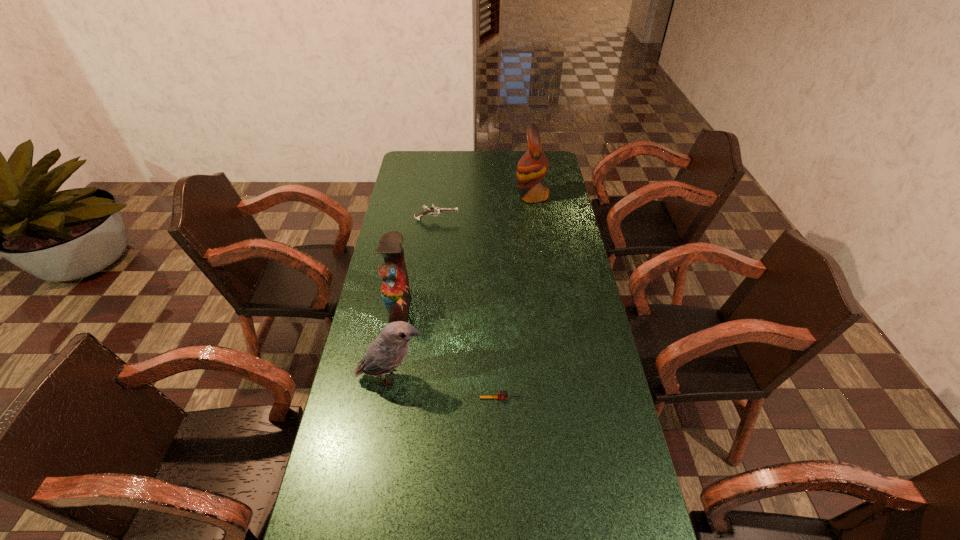
Image resolution: width=960 pixels, height=540 pixels. Find the location of `parrot that can be found as the third closest to the nearest object`. parrot that can be found as the third closest to the nearest object is located at coordinates (533, 165).

I want to click on free space that satisfies the following two spatial constraints: 1. at the face of the second nearest parrot; 2. on the right side of the tape measure, so click(383, 398).

Locate an element on the screen. vacant region that satisfies the following two spatial constraints: 1. aimed along the barrel of the fourth tallest object; 2. on the back side of the tape measure is located at coordinates (416, 398).

This screenshot has height=540, width=960. I want to click on free point that satisfies the following two spatial constraints: 1. on the front-facing side of the second nearest object; 2. on the left side of the fourth object from left to right, so click(x=388, y=398).

The height and width of the screenshot is (540, 960). I want to click on free spot that satisfies the following two spatial constraints: 1. aimed along the barrel of the gun; 2. on the back side of the shortest object, so click(x=416, y=398).